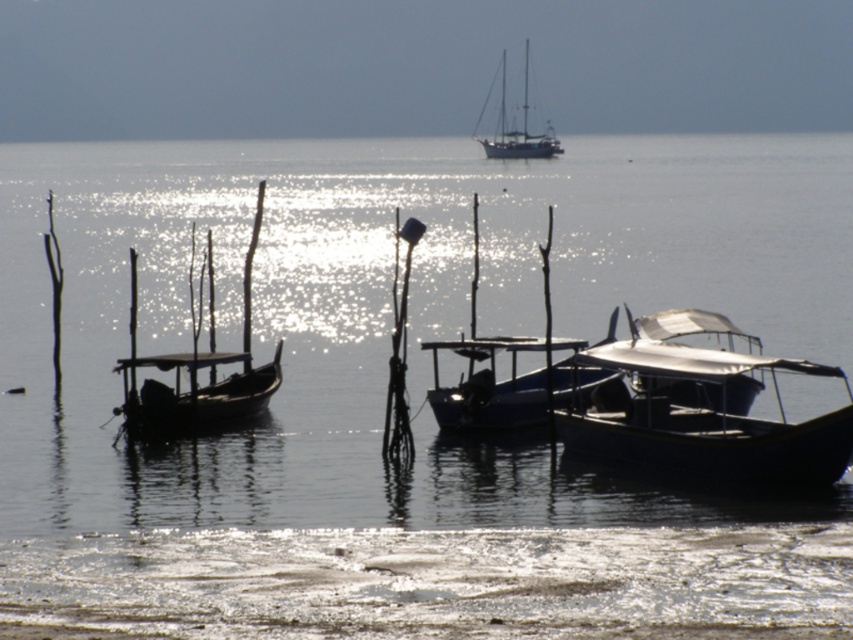
You are a fisherman who needs to choose between the metallic blue boat at lower right and the blue matte boat at center for a deep sea fishing trip. Considering the height of the boats, which one would be more suitable for carrying large fishing equipment?

The blue matte boat at center is taller than the metallic blue boat at lower right, making it more suitable for carrying large fishing equipment.

You are a photographer planning to capture the boats in the scene. You want to ensure both the metallic blue boat at lower right and the blue matte boat at center are fully visible in your shot. Given their sizes, which boat might require you to adjust your camera angle to avoid cropping parts of it?

The blue matte boat at center occupies more space than the metallic blue boat at lower right, so you might need to adjust your camera angle to ensure the entire blue matte boat at center is visible without cropping.

You are standing on the shore looking at the three boats in the foreground. Which of the two points, point (506, 401) or point (502, 68), is closer to you?

Point (506, 401) is closer to you than point (502, 68).